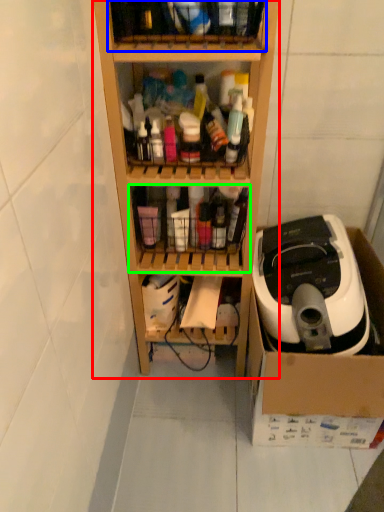
Question: Which is nearer to the shelf (highlighted by a red box)? shelf (highlighted by a blue box) or shelf (highlighted by a green box).

Choices:
 (A) shelf
 (B) shelf

Answer: (B)